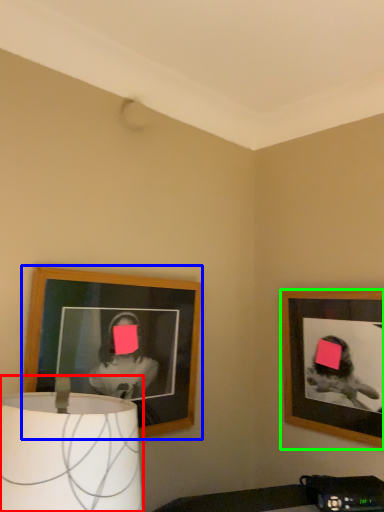
Question: Which is farther away from lamp (highlighted by a red box)? picture frame (highlighted by a blue box) or picture frame (highlighted by a green box)?

Choices:
 (A) picture frame
 (B) picture frame

Answer: (B)